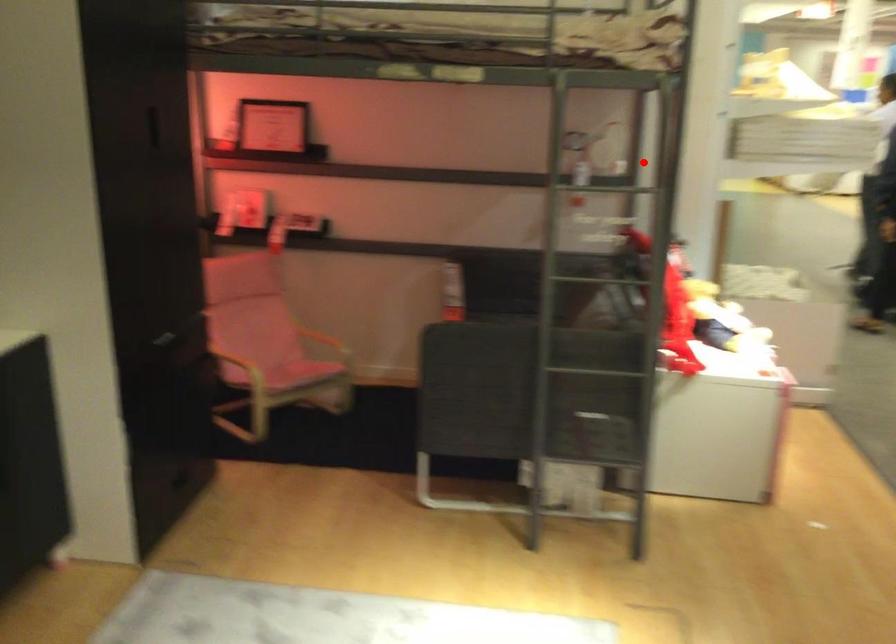
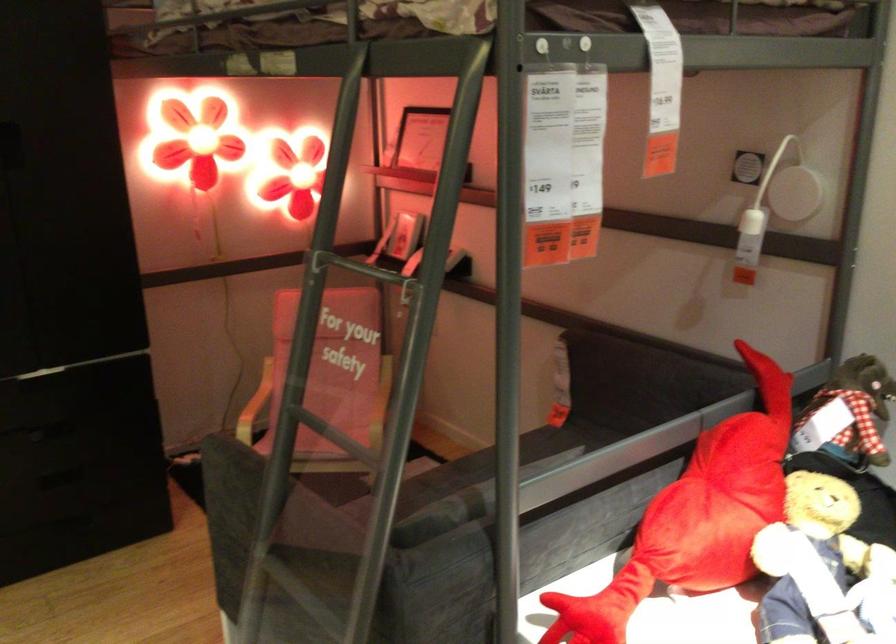
Question: I am providing you with two images of the same scene from different viewpoints. Image1 has a red point marked. In image2, the corresponding 3D location appears at what relative position? Reply with the corresponding letter.

Choices:
 (A) Closer
 (B) Farther

Answer: (A)